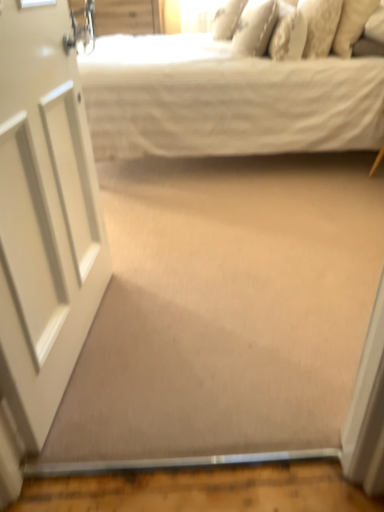
Image resolution: width=384 pixels, height=512 pixels. Describe the element at coordinates (288, 34) in the screenshot. I see `white textured pillow at upper center, which is counted as the 3th pillow, starting from the right` at that location.

Measure the distance between white textured pillow at upper center, placed as the fifth pillow when sorted from right to left, and camera.

They are 9.46 feet apart.

Locate an element on the screen. The height and width of the screenshot is (512, 384). white textured pillow at upper right, acting as the fifth pillow starting from the left is located at coordinates coord(352,24).

Where is `white textured pillow at upper center, which is the 4th pillow from right to left`? white textured pillow at upper center, which is the 4th pillow from right to left is located at coordinates (255, 27).

This screenshot has height=512, width=384. What do you see at coordinates (225, 100) in the screenshot?
I see `white cotton bed at upper center` at bounding box center [225, 100].

You are a GUI agent. You are given a task and a screenshot of the screen. Output one action in this format:
    pyautogui.click(x=<x>, y=<y>)
    Task: Click on the white textured pillow at upper center, the 3th pillow positioned from the left
    
    Given the screenshot: What is the action you would take?
    pyautogui.click(x=288, y=34)

Considering the sizes of white cotton bed at upper center and floral-patterned fabric pillow at upper right, arranged as the 4th pillow when viewed from the left, in the image, is white cotton bed at upper center bigger or smaller than floral-patterned fabric pillow at upper right, arranged as the 4th pillow when viewed from the left,?

In the image, white cotton bed at upper center appears to be larger than floral-patterned fabric pillow at upper right, arranged as the 4th pillow when viewed from the left.

Would you say white cotton bed at upper center is to the left or to the right of floral-patterned fabric pillow at upper right, arranged as the 4th pillow when viewed from the left, in the picture?

In the image, white cotton bed at upper center appears on the left side of floral-patterned fabric pillow at upper right, arranged as the 4th pillow when viewed from the left.

Considering the relative sizes of white cotton bed at upper center and floral-patterned fabric pillow at upper right, arranged as the 4th pillow when viewed from the left, in the image provided, is white cotton bed at upper center taller than floral-patterned fabric pillow at upper right, arranged as the 4th pillow when viewed from the left,?

Correct, white cotton bed at upper center is much taller as floral-patterned fabric pillow at upper right, arranged as the 4th pillow when viewed from the left.

Does white cotton bed at upper center come behind floral-patterned fabric pillow at upper right, arranged as the 4th pillow when viewed from the left?

That is False.

Locate an element on the screen. pillow that is the 5th one when counting backward from the white glossy door at left is located at coordinates (227, 19).

From the image's perspective, would you say white glossy door at left is positioned over white textured pillow at upper center, arranged as the 1th pillow when viewed from the left?

No.

Considering the sizes of objects white textured pillow at upper center, arranged as the 1th pillow when viewed from the left, and white textured pillow at upper center, which is the 4th pillow from right to left, in the image provided, who is smaller, white textured pillow at upper center, arranged as the 1th pillow when viewed from the left, or white textured pillow at upper center, which is the 4th pillow from right to left,?

white textured pillow at upper center, arranged as the 1th pillow when viewed from the left.

Locate an element on the screen. This screenshot has width=384, height=512. pillow that is the 1st object to the right of the white textured pillow at upper center, placed as the fifth pillow when sorted from right to left, starting at the anchor is located at coordinates (255, 27).

Which of these two, white textured pillow at upper center, arranged as the 1th pillow when viewed from the left, or white textured pillow at upper center, positioned as the 2th pillow in left-to-right order, is wider?

Wider between the two is white textured pillow at upper center, positioned as the 2th pillow in left-to-right order.

Considering the sizes of objects white textured pillow at upper center, placed as the fifth pillow when sorted from right to left, and white textured pillow at upper center, which is the 4th pillow from right to left, in the image provided, who is taller, white textured pillow at upper center, placed as the fifth pillow when sorted from right to left, or white textured pillow at upper center, which is the 4th pillow from right to left,?

With more height is white textured pillow at upper center, which is the 4th pillow from right to left.

Is white textured pillow at upper center, placed as the fifth pillow when sorted from right to left, at the back of white textured pillow at upper center, which is the 4th pillow from right to left?

No.

From a real-world perspective, which is physically above, white textured pillow at upper center, positioned as the 2th pillow in left-to-right order, or white textured pillow at upper center, placed as the fifth pillow when sorted from right to left?

white textured pillow at upper center, positioned as the 2th pillow in left-to-right order.

From the image's perspective, does white textured pillow at upper center, which is the 4th pillow from right to left, appear lower than white textured pillow at upper center, placed as the fifth pillow when sorted from right to left?

Yes.

Is white textured pillow at upper center, positioned as the 2th pillow in left-to-right order, next to white textured pillow at upper center, arranged as the 1th pillow when viewed from the left, and touching it?

They are not placed beside each other.

Does white cotton bed at upper center have a greater height compared to white textured pillow at upper center, positioned as the 2th pillow in left-to-right order?

Correct, white cotton bed at upper center is much taller as white textured pillow at upper center, positioned as the 2th pillow in left-to-right order.

In the scene shown: Visually, is white cotton bed at upper center positioned to the left or to the right of white textured pillow at upper center, positioned as the 2th pillow in left-to-right order?

Clearly, white cotton bed at upper center is on the left of white textured pillow at upper center, positioned as the 2th pillow in left-to-right order, in the image.

I want to click on bed directly beneath the white textured pillow at upper center, which is the 4th pillow from right to left (from a real-world perspective), so click(225, 100).

From a real-world perspective, is white cotton bed at upper center physically above white textured pillow at upper center, which is counted as the 3th pillow, starting from the right?

No.

How many degrees apart are the facing directions of white cotton bed at upper center and white textured pillow at upper center, which is counted as the 3th pillow, starting from the right?

The angular difference between white cotton bed at upper center and white textured pillow at upper center, which is counted as the 3th pillow, starting from the right, is 3.63 degrees.

Is white cotton bed at upper center outside of white textured pillow at upper center, the 3th pillow positioned from the left?

Indeed, white cotton bed at upper center is completely outside white textured pillow at upper center, the 3th pillow positioned from the left.

Are white cotton bed at upper center and white textured pillow at upper center, the 3th pillow positioned from the left, beside each other?

white cotton bed at upper center and white textured pillow at upper center, the 3th pillow positioned from the left, are clearly separated.

Looking at this image, could you measure the distance between white textured pillow at upper center, which is the 4th pillow from right to left, and white cotton bed at upper center?

A distance of 18.82 inches exists between white textured pillow at upper center, which is the 4th pillow from right to left, and white cotton bed at upper center.

Is the position of white textured pillow at upper center, positioned as the 2th pillow in left-to-right order, more distant than that of white cotton bed at upper center?

Yes, white textured pillow at upper center, positioned as the 2th pillow in left-to-right order, is behind white cotton bed at upper center.

Does white textured pillow at upper center, positioned as the 2th pillow in left-to-right order, have a lesser width compared to white cotton bed at upper center?

Indeed, white textured pillow at upper center, positioned as the 2th pillow in left-to-right order, has a lesser width compared to white cotton bed at upper center.

Would you say white textured pillow at upper center, positioned as the 2th pillow in left-to-right order, is to the left or to the right of white cotton bed at upper center in the picture?

white textured pillow at upper center, positioned as the 2th pillow in left-to-right order, is positioned on white cotton bed at upper center's right side.

Where is `the 3rd pillow behind the white cotton bed at upper center`? The height and width of the screenshot is (512, 384). the 3rd pillow behind the white cotton bed at upper center is located at coordinates (320, 25).

In order to click on pillow that is the 5th object located above the white glossy door at left (from the image's perspective) in this screenshot , I will do `click(227, 19)`.

Estimate the real-world distances between objects in this image. Which object is further from white textured pillow at upper center, positioned as the 2th pillow in left-to-right order, white textured pillow at upper center, the 3th pillow positioned from the left, or white textured pillow at upper center, placed as the fifth pillow when sorted from right to left?

The object further to white textured pillow at upper center, positioned as the 2th pillow in left-to-right order, is white textured pillow at upper center, placed as the fifth pillow when sorted from right to left.

Looking at the image, which one is located closer to white textured pillow at upper center, which is the 4th pillow from right to left, white cotton bed at upper center or floral-patterned fabric pillow at upper right, the second pillow positioned from the right?

floral-patterned fabric pillow at upper right, the second pillow positioned from the right, is closer to white textured pillow at upper center, which is the 4th pillow from right to left.

Based on their spatial positions, is white textured pillow at upper center, arranged as the 1th pillow when viewed from the left, or white textured pillow at upper center, the 3th pillow positioned from the left, further from white textured pillow at upper center, which is the 4th pillow from right to left?

The object further to white textured pillow at upper center, which is the 4th pillow from right to left, is white textured pillow at upper center, arranged as the 1th pillow when viewed from the left.

From the image, which object appears to be nearer to floral-patterned fabric pillow at upper right, arranged as the 4th pillow when viewed from the left, white glossy door at left or white textured pillow at upper center, positioned as the 2th pillow in left-to-right order?

Among the two, white textured pillow at upper center, positioned as the 2th pillow in left-to-right order, is located nearer to floral-patterned fabric pillow at upper right, arranged as the 4th pillow when viewed from the left.

From the image, which object appears to be nearer to white cotton bed at upper center, white textured pillow at upper center, which is counted as the 3th pillow, starting from the right, or floral-patterned fabric pillow at upper right, the second pillow positioned from the right?

white textured pillow at upper center, which is counted as the 3th pillow, starting from the right, is positioned closer to the anchor white cotton bed at upper center.

Estimate the real-world distances between objects in this image. Which object is closer to white textured pillow at upper right, acting as the fifth pillow starting from the left, floral-patterned fabric pillow at upper right, arranged as the 4th pillow when viewed from the left, or white textured pillow at upper center, positioned as the 2th pillow in left-to-right order?

floral-patterned fabric pillow at upper right, arranged as the 4th pillow when viewed from the left, lies closer to white textured pillow at upper right, acting as the fifth pillow starting from the left, than the other object.

Estimate the real-world distances between objects in this image. Which object is closer to white textured pillow at upper center, which is the 4th pillow from right to left, floral-patterned fabric pillow at upper right, the second pillow positioned from the right, or white glossy door at left?

floral-patterned fabric pillow at upper right, the second pillow positioned from the right, lies closer to white textured pillow at upper center, which is the 4th pillow from right to left, than the other object.

Estimate the real-world distances between objects in this image. Which object is closer to white textured pillow at upper center, which is the 4th pillow from right to left, floral-patterned fabric pillow at upper right, the second pillow positioned from the right, or white cotton bed at upper center?

Among the two, floral-patterned fabric pillow at upper right, the second pillow positioned from the right, is located nearer to white textured pillow at upper center, which is the 4th pillow from right to left.

The height and width of the screenshot is (512, 384). I want to click on bed between white glossy door at left and white textured pillow at upper center, placed as the fifth pillow when sorted from right to left, in the front-back direction, so click(225, 100).

What are the coordinates of `bed between white glossy door at left and white textured pillow at upper center, positioned as the 2th pillow in left-to-right order, in the front-back direction` in the screenshot? It's located at (225, 100).

The height and width of the screenshot is (512, 384). Identify the location of pillow between white textured pillow at upper center, positioned as the 2th pillow in left-to-right order, and floral-patterned fabric pillow at upper right, arranged as the 4th pillow when viewed from the left, from left to right. (288, 34).

Locate an element on the screen. bed between white glossy door at left and floral-patterned fabric pillow at upper right, the second pillow positioned from the right, in the front-back direction is located at coordinates (225, 100).